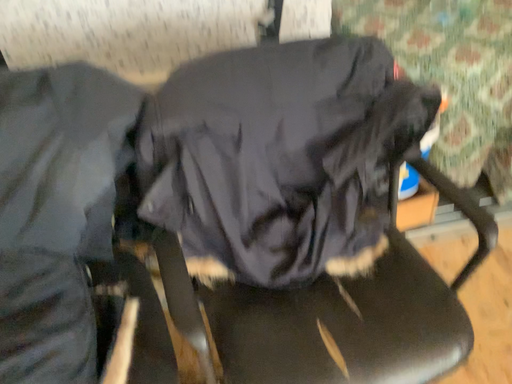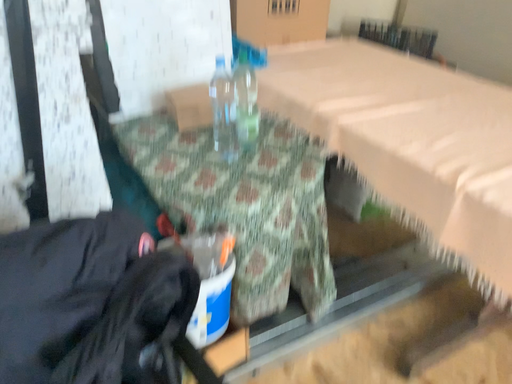
Question: How did the camera likely rotate when shooting the video?

Choices:
 (A) rotated upward
 (B) rotated downward

Answer: (A)